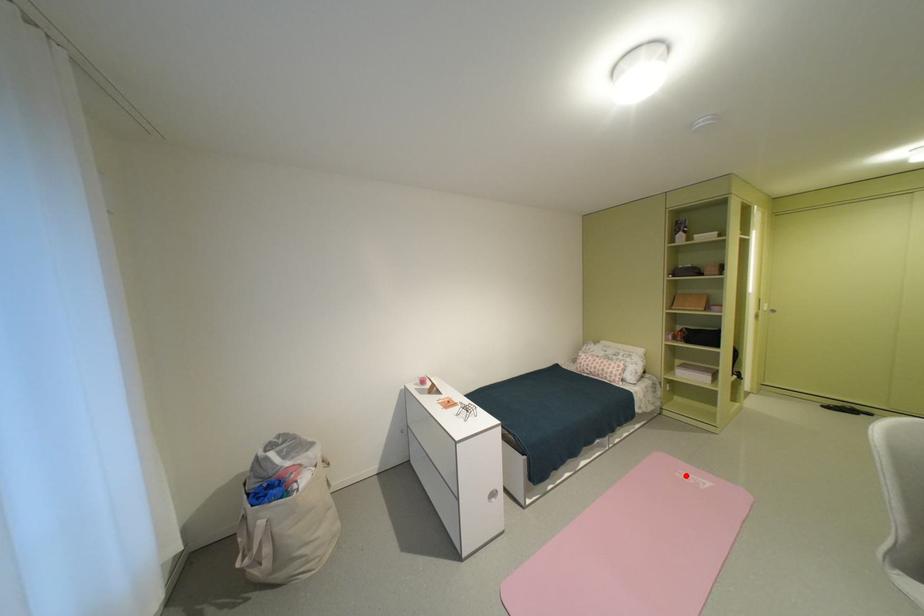
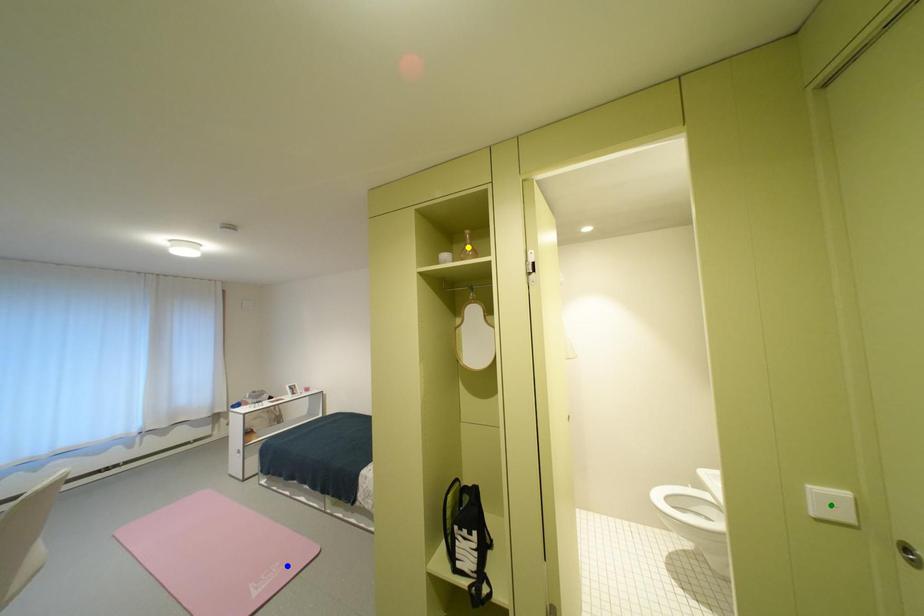
Question: I am providing you with two images of the same scene from different viewpoints. A red point is marked on the first image. You are given multiple points on the second image. Which point in image 2 represents the same 3d spot as the red point in image 1?

Choices:
 (A) yellow point
 (B) green point
 (C) blue point

Answer: (C)